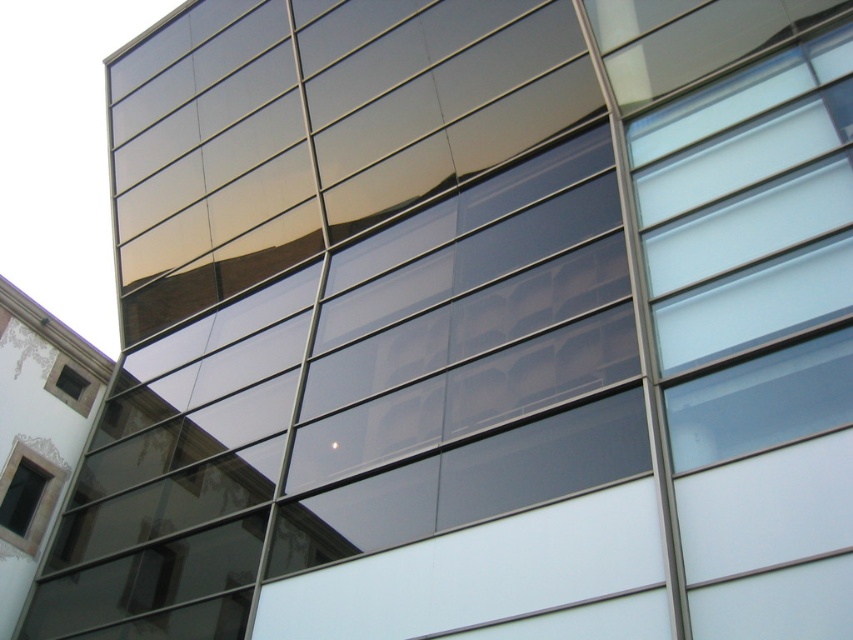
How distant is matte glass window at lower left from matte black window at lower left?

2.40 meters

Who is more distant from viewer, (13, 502) or (86, 384)?

Point (86, 384)

What are the coordinates of `matte glass window at lower left` in the screenshot? It's located at (22, 497).